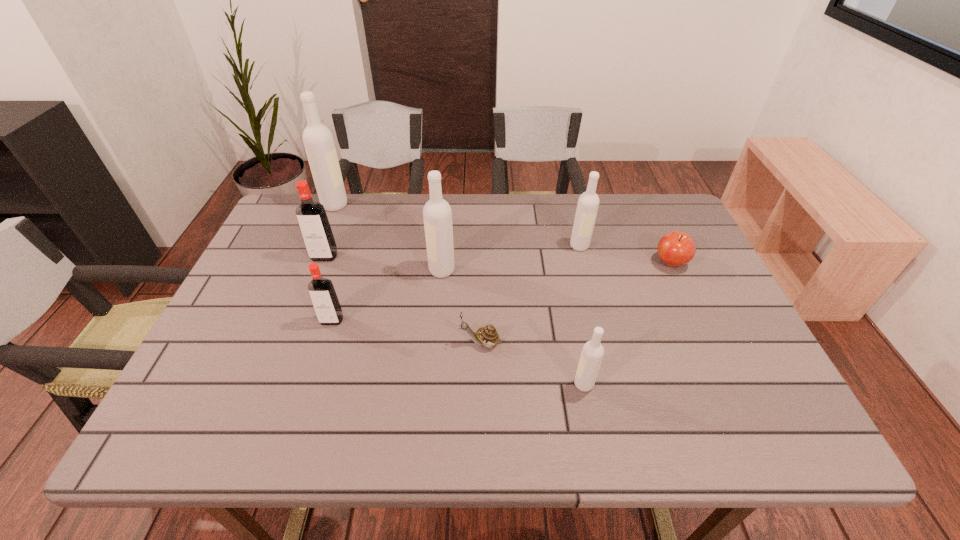
At what (x,y) coordinates should I click in order to perform the action: click on free point located 0.130m on the front and back of the fifth farthest vodka. Please return your answer as a coordinate pair (x, y). This screenshot has height=540, width=960. Looking at the image, I should click on (316, 373).

Where is `free space located on the back of the apple`? Image resolution: width=960 pixels, height=540 pixels. free space located on the back of the apple is located at coordinates (656, 230).

Identify the location of vacant space located on the face of the seventh farthest object. This screenshot has height=540, width=960. (292, 343).

You are a GUI agent. You are given a task and a screenshot of the screen. Output one action in this format:
    pyautogui.click(x=<x>, y=<y>)
    Task: Click on the vacant space situated on the face of the seventh farthest object
    This screenshot has width=960, height=540.
    Given the screenshot: What is the action you would take?
    pyautogui.click(x=373, y=343)

The width and height of the screenshot is (960, 540). In order to click on vacant region located on the face of the seventh farthest object in this screenshot , I will do `click(408, 343)`.

Where is `object that is at the right edge`? The image size is (960, 540). object that is at the right edge is located at coordinates (675, 248).

The height and width of the screenshot is (540, 960). I want to click on object situated at the far left corner, so click(318, 140).

The image size is (960, 540). What are the coordinates of `free spot at the far edge of the desktop` in the screenshot? It's located at (341, 227).

Where is `free space at the near edge`? The image size is (960, 540). free space at the near edge is located at coordinates (673, 430).

In order to click on vacant space at the left edge of the desktop in this screenshot , I will do `click(259, 307)`.